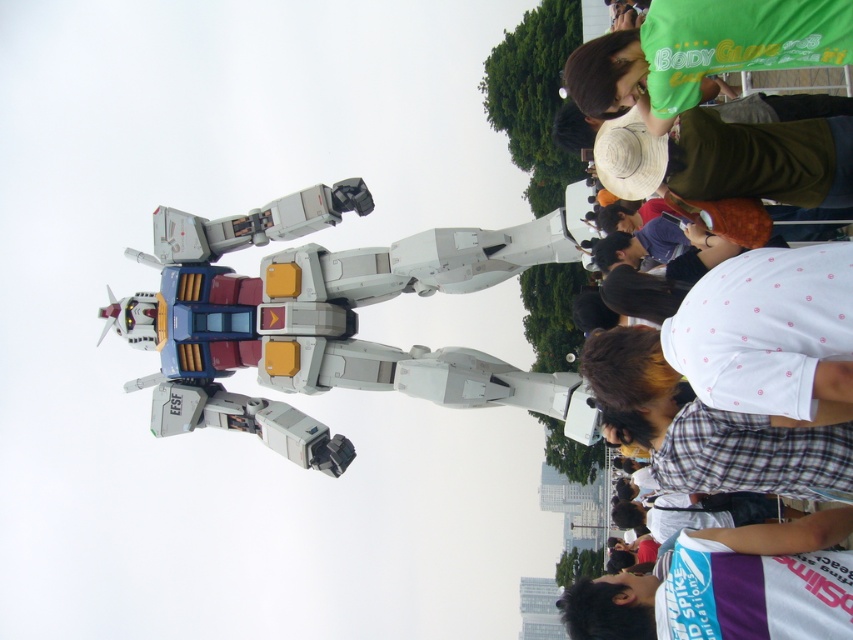
Question: Which of the following is the closest to the observer?

Choices:
 (A) white dotted shirt at upper right
 (B) white fabric at lower right
 (C) green fabric shirt at upper right

Answer: (A)

Question: Does green fabric shirt at upper right have a smaller size compared to white fabric at lower right?

Choices:
 (A) no
 (B) yes

Answer: (A)

Question: Is green fabric shirt at upper right below white fabric at lower right?

Choices:
 (A) yes
 (B) no

Answer: (B)

Question: Which of the following is the closest to the observer?

Choices:
 (A) white fabric at lower right
 (B) white dotted shirt at upper right

Answer: (B)

Question: Which point is closer to the camera?

Choices:
 (A) white dotted shirt at upper right
 (B) white fabric at lower right
 (C) green fabric shirt at upper right

Answer: (A)

Question: Can you confirm if green fabric shirt at upper right is bigger than white fabric at lower right?

Choices:
 (A) no
 (B) yes

Answer: (B)